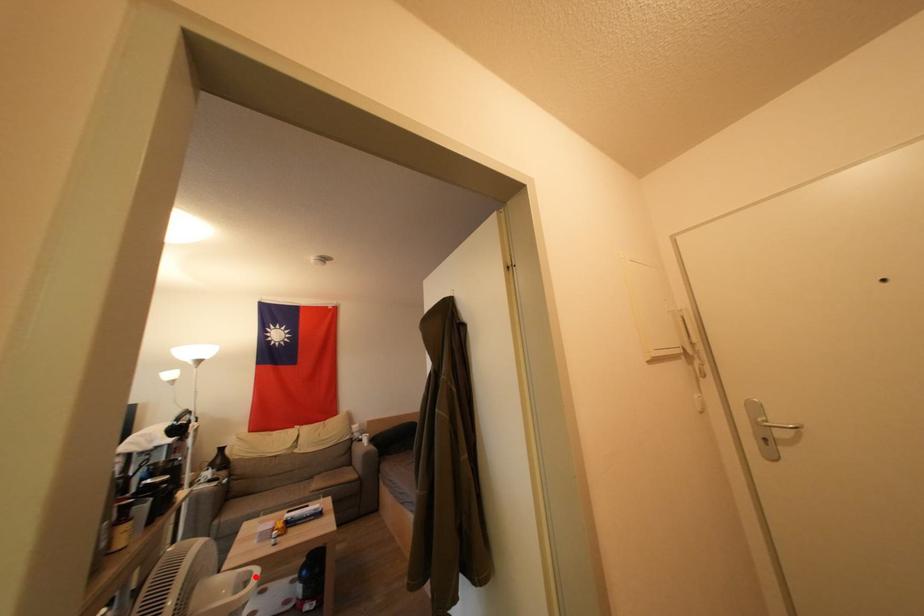
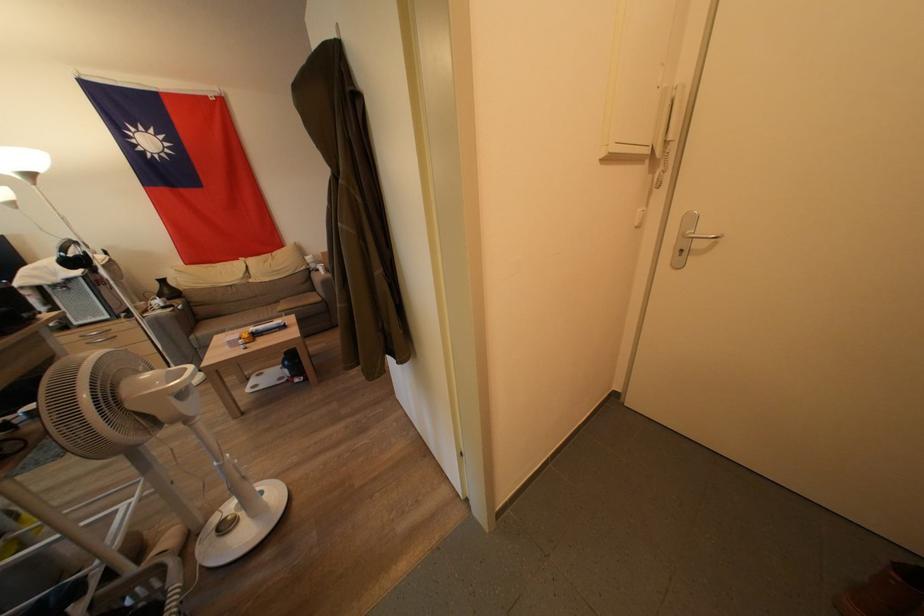
Locate, in the second image, the point that corresponds to the highlighted location in the first image.

(190, 373)